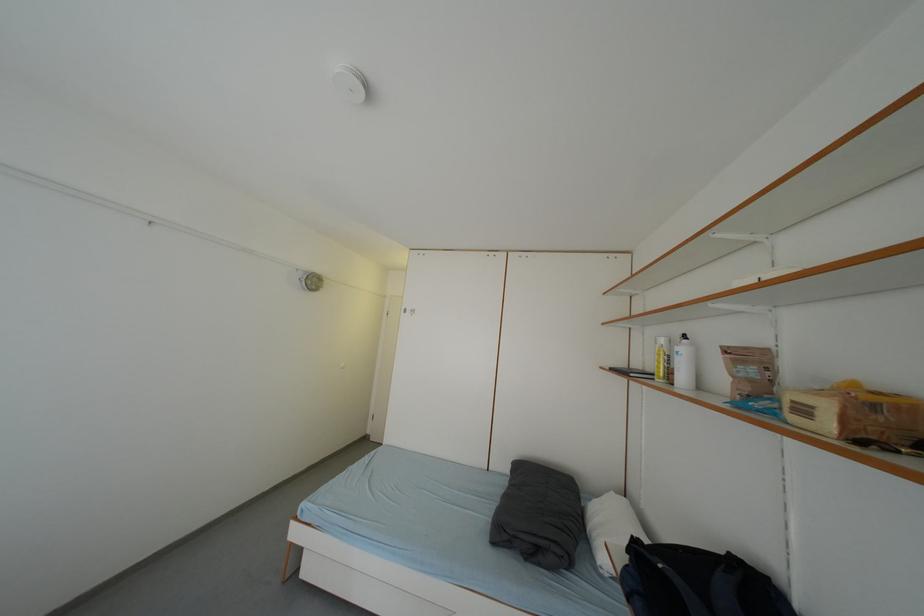
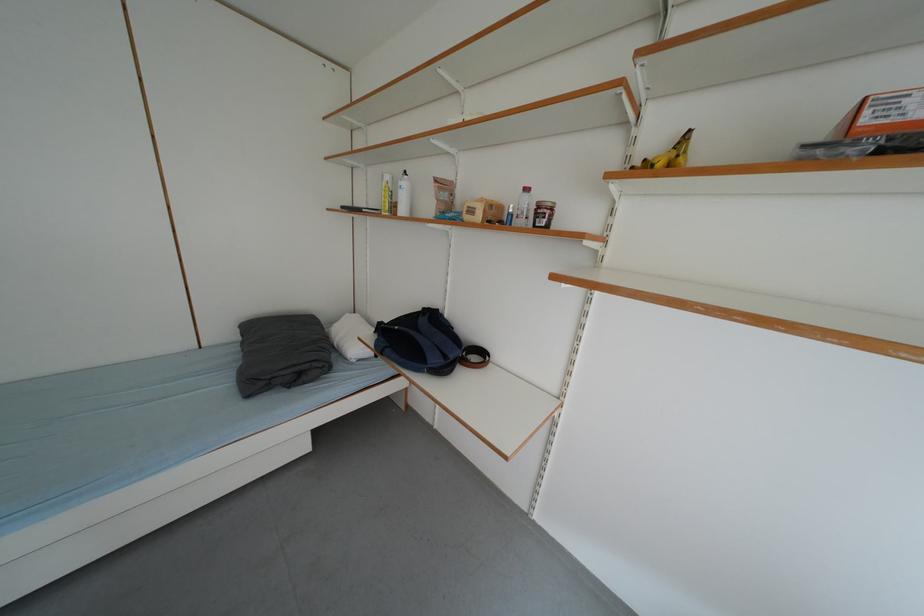
The point at (836, 429) is marked in the first image. Where is the corresponding point in the second image?

(487, 220)